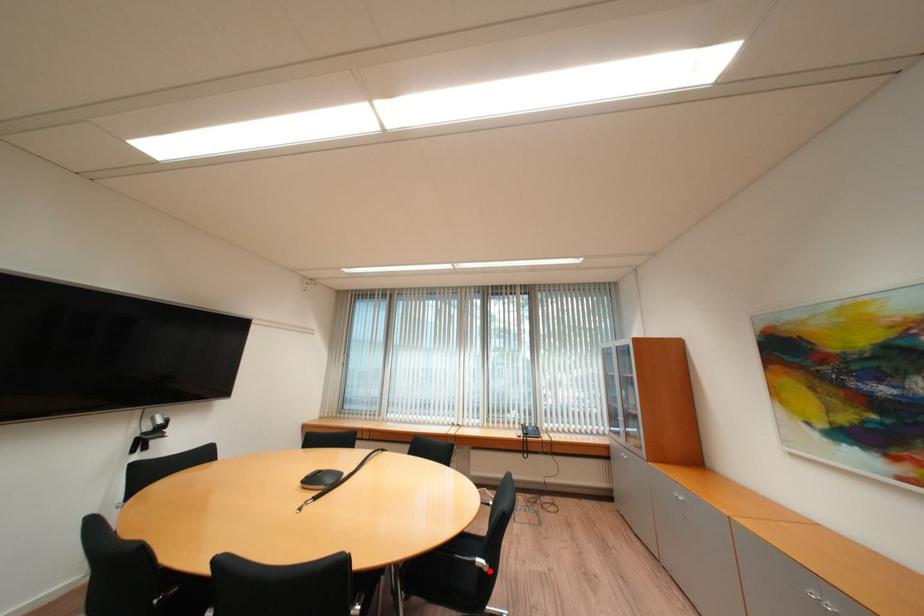
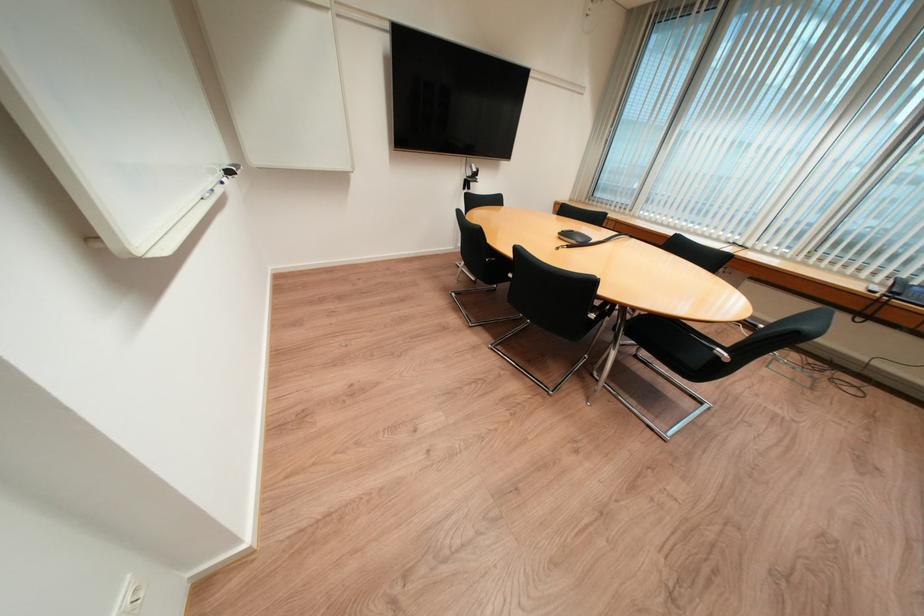
Where in the second image is the point corresponding to the highlighted location from the first image?

(725, 359)